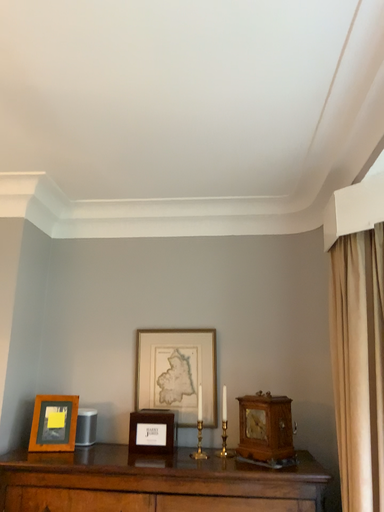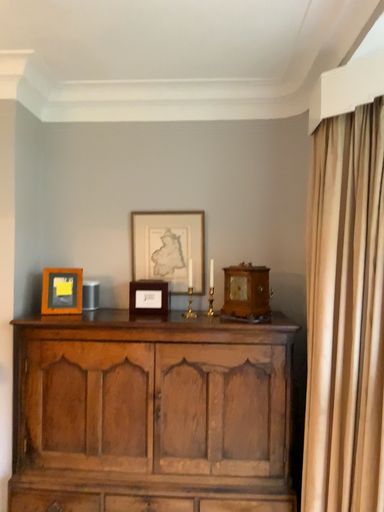
Question: Which way did the camera rotate in the video?

Choices:
 (A) rotated downward
 (B) rotated upward

Answer: (A)